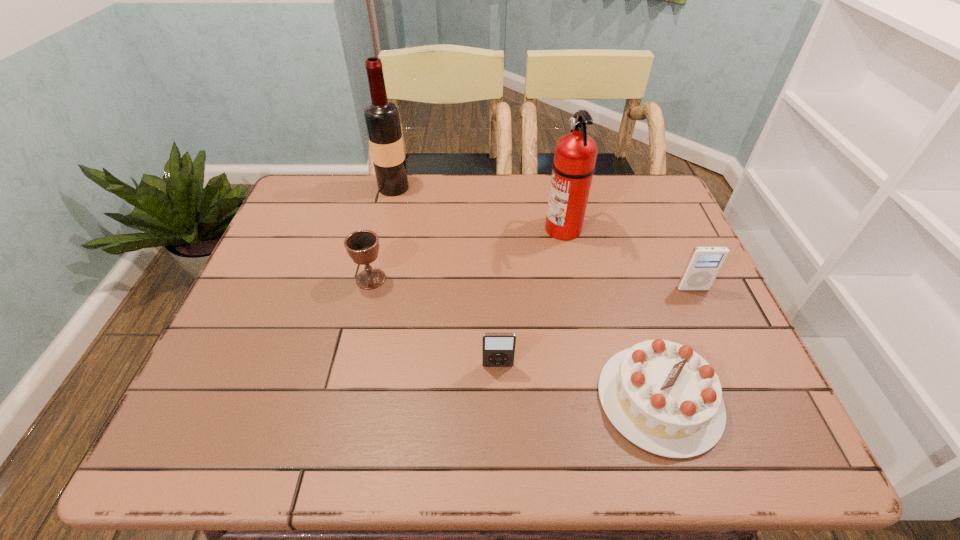
This screenshot has width=960, height=540. In order to click on birthday cake located in the right edge section of the desktop in this screenshot , I will do `click(665, 398)`.

You are a GUI agent. You are given a task and a screenshot of the screen. Output one action in this format:
    pyautogui.click(x=<x>, y=<y>)
    Task: Click on the object that is at the near right corner
    
    Given the screenshot: What is the action you would take?
    pyautogui.click(x=665, y=398)

In the image, there is a desktop. Identify the location of free region at the far edge. This screenshot has width=960, height=540. (379, 201).

What are the coordinates of `free space at the near edge of the desktop` in the screenshot? It's located at (588, 441).

The height and width of the screenshot is (540, 960). In the image, there is a desktop. What are the coordinates of `vacant space at the left edge` in the screenshot? It's located at (274, 382).

Where is `free space at the right edge`? The image size is (960, 540). free space at the right edge is located at coordinates (709, 318).

Where is `vacant area at the far left corner`? The height and width of the screenshot is (540, 960). vacant area at the far left corner is located at coordinates (337, 193).

Where is `vacant space at the far right corner of the desktop`? The height and width of the screenshot is (540, 960). vacant space at the far right corner of the desktop is located at coordinates (653, 174).

This screenshot has width=960, height=540. In the image, there is a desktop. Find the location of `free space at the near right corner`. free space at the near right corner is located at coordinates (763, 433).

At what (x,y) coordinates should I click in order to perform the action: click on free area in between the chalice and the shorter iPod. Please return your answer as a coordinate pair (x, y). The image size is (960, 540). Looking at the image, I should click on (434, 322).